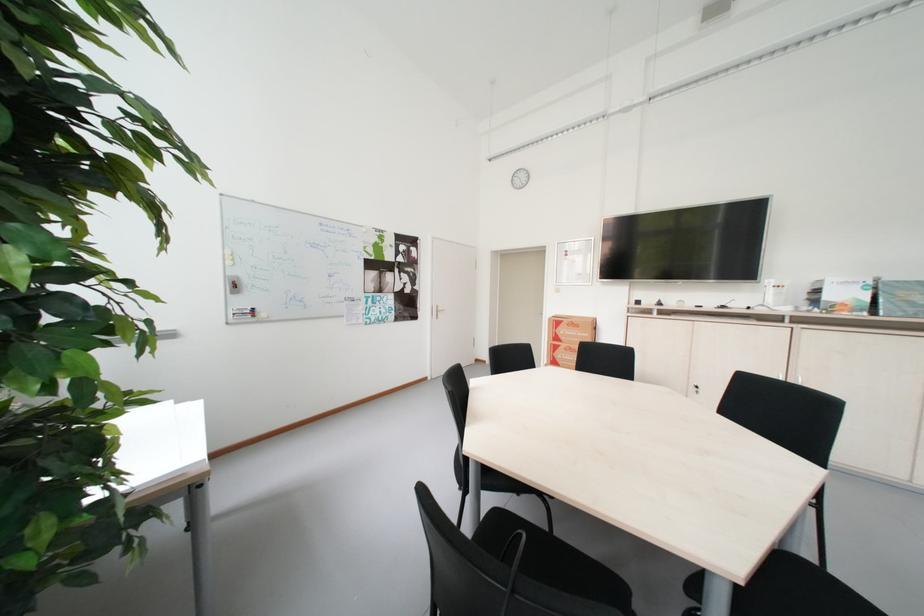
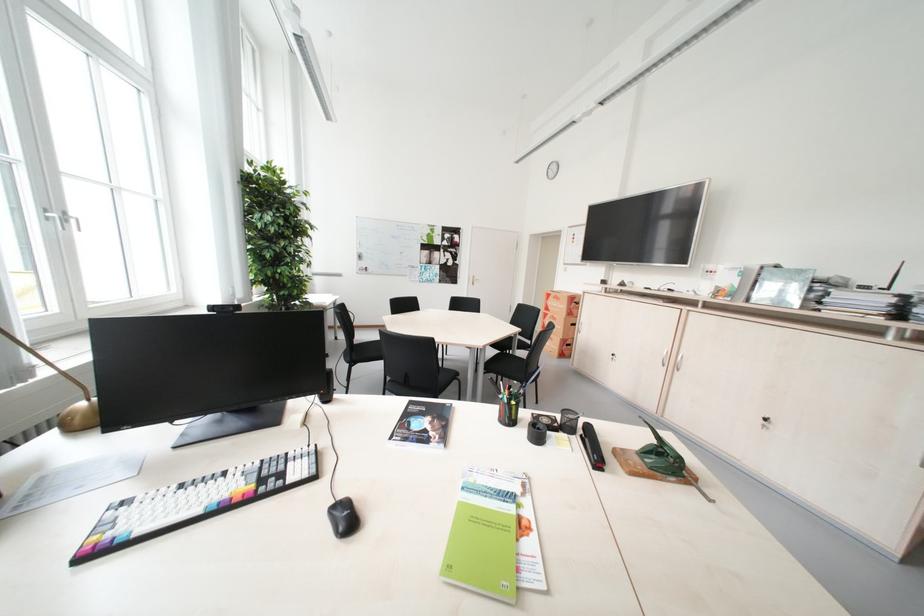
Where in the second image is the point corresponding to [434,305] from the first image?

(473, 275)